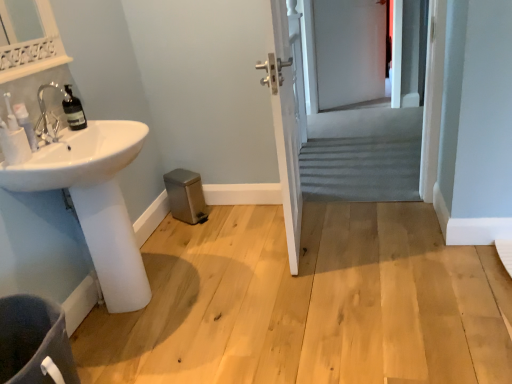
This screenshot has width=512, height=384. I want to click on free space between white wooden door at center and white glossy sink at lower left, so [228, 258].